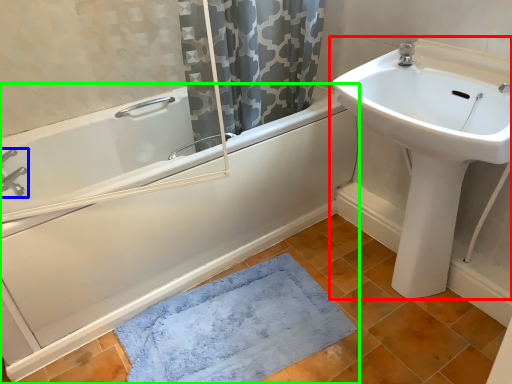
Question: Which is nearer to the sink (highlighted by a red box)? tap (highlighted by a blue box) or bathtub (highlighted by a green box).

Choices:
 (A) tap
 (B) bathtub

Answer: (B)